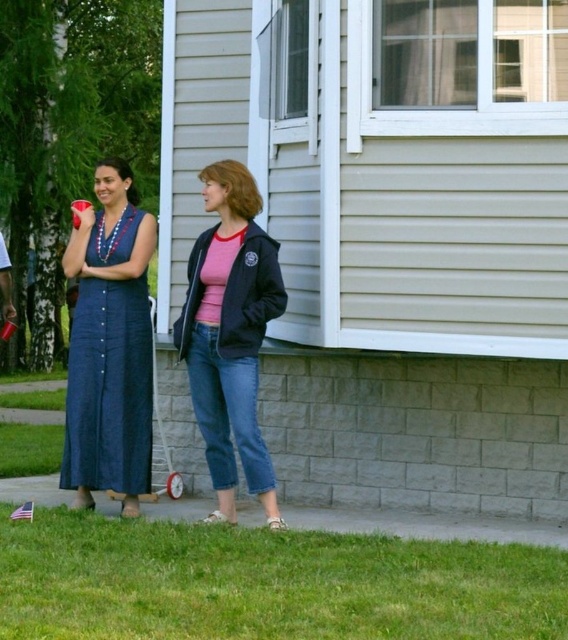
Question: Which object is the closest to the green grass at lower left?

Choices:
 (A) denim dress at left
 (B) matte black jacket at center

Answer: (B)

Question: Does green grass at lower left appear over denim dress at left?

Choices:
 (A) no
 (B) yes

Answer: (A)

Question: Is the position of green grass at lower left less distant than that of matte black jacket at center?

Choices:
 (A) yes
 (B) no

Answer: (A)

Question: Based on their relative distances, which object is farther from the denim dress at left?

Choices:
 (A) matte black jacket at center
 (B) green grass at lower left

Answer: (B)

Question: Which of the following is the farthest from the observer?

Choices:
 (A) (23, 609)
 (B) (122, 412)

Answer: (B)

Question: Is green grass at lower left positioned before denim dress at left?

Choices:
 (A) no
 (B) yes

Answer: (B)